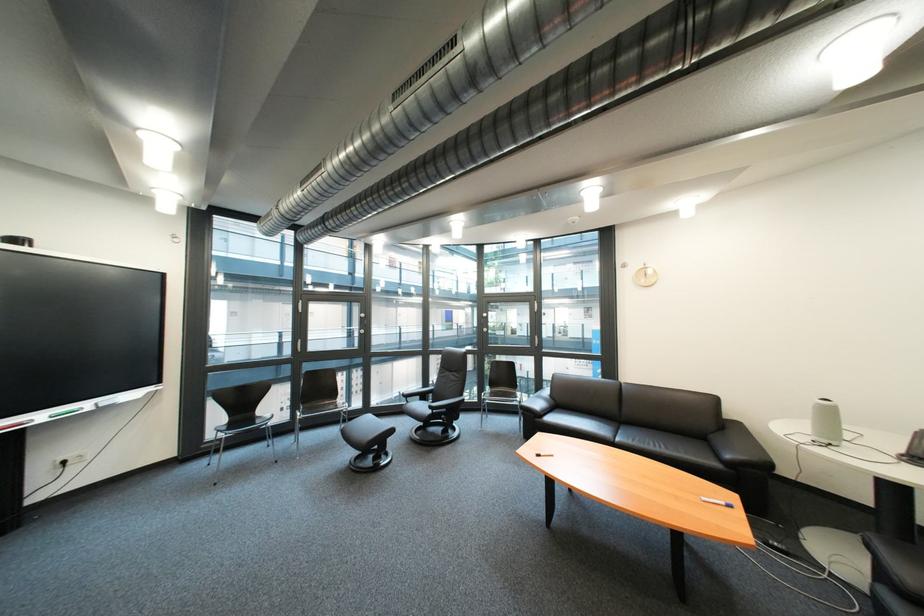
Which object does [367,432] point to?

This point indicates the black leather footrest.